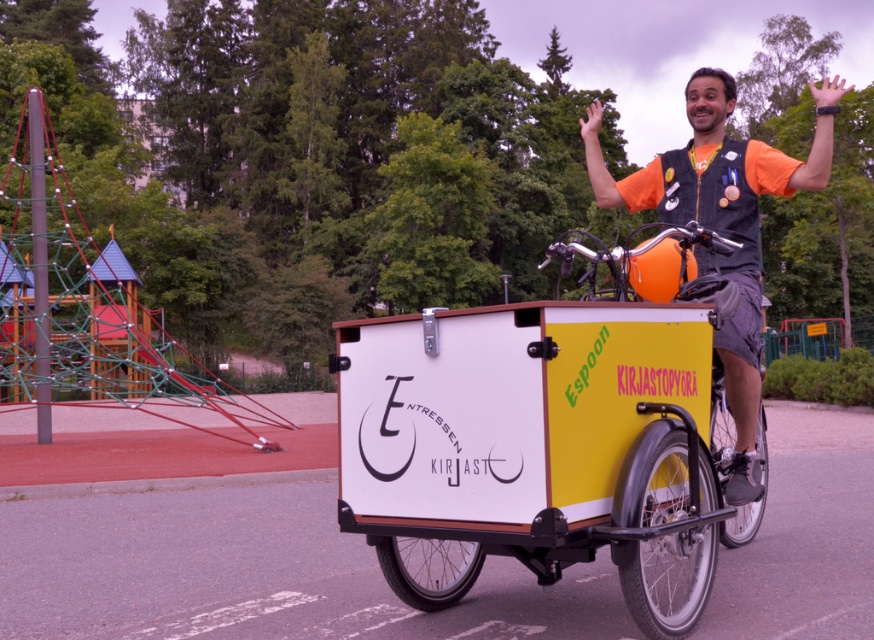
You are a pedestrian standing near the white matte cargo bike at center and the orange fabric vest at upper center. Which object is smaller in size?

The white matte cargo bike at center is smaller in size compared to the orange fabric vest at upper center.

You are a pedestrian standing on the sidewalk next to the path where the man is riding the white matte cargo bike at center and the yellow matte cargo bike at center. Which bike do you see first as they approach you?

You will see the white matte cargo bike at center first because it is closer to you than the yellow matte cargo bike at center.

You are standing at the point with coordinates (542, 445) in the image. What object is located exactly at this point?

The point at coordinates (542, 445) indicates the white matte cargo bike at center.